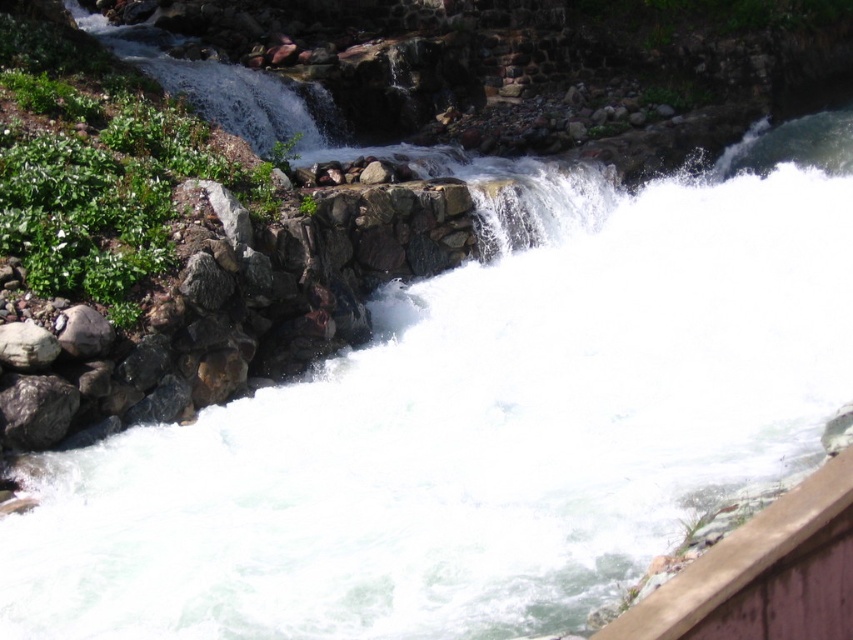
Describe the element at coordinates (763, 573) in the screenshot. Image resolution: width=853 pixels, height=640 pixels. I see `brown wooden ledge at lower right` at that location.

Can you confirm if brown wooden ledge at lower right is bigger than gray rough rock at left?

Yes.

What do you see at coordinates (763, 573) in the screenshot? The image size is (853, 640). I see `brown wooden ledge at lower right` at bounding box center [763, 573].

Where is `brown wooden ledge at lower right`? This screenshot has height=640, width=853. brown wooden ledge at lower right is located at coordinates (763, 573).